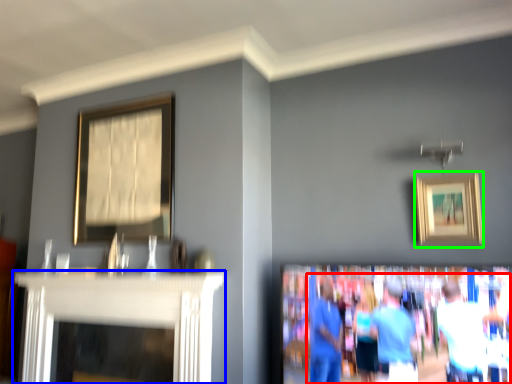
Question: Which is nearer to the couple (highlighted by a red box)? fireplace (highlighted by a blue box) or picture frame (highlighted by a green box).

Choices:
 (A) fireplace
 (B) picture frame

Answer: (B)